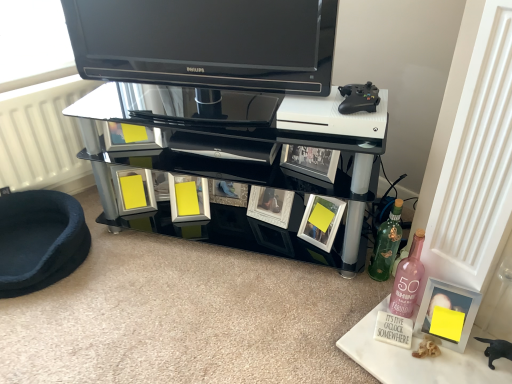
This screenshot has height=384, width=512. I want to click on vacant space in front of black glass shelf at center, so click(x=230, y=312).